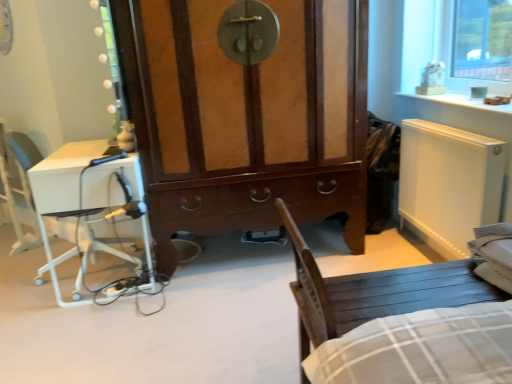
Question: Does wooden chair at lower right have a greater height compared to brown wood cabinet at center?

Choices:
 (A) no
 (B) yes

Answer: (A)

Question: Does wooden chair at lower right have a lesser height compared to brown wood cabinet at center?

Choices:
 (A) yes
 (B) no

Answer: (A)

Question: Considering the relative positions of wooden chair at lower right and brown wood cabinet at center in the image provided, is wooden chair at lower right behind brown wood cabinet at center?

Choices:
 (A) no
 (B) yes

Answer: (A)

Question: From the image's perspective, does wooden chair at lower right appear lower than brown wood cabinet at center?

Choices:
 (A) no
 (B) yes

Answer: (B)

Question: From the image's perspective, is wooden chair at lower right on brown wood cabinet at center?

Choices:
 (A) yes
 (B) no

Answer: (B)

Question: Is wooden chair at lower right touching brown wood cabinet at center?

Choices:
 (A) yes
 (B) no

Answer: (B)

Question: Is brown wood cabinet at center closer to the viewer compared to white glossy desk at left?

Choices:
 (A) no
 (B) yes

Answer: (B)

Question: Does brown wood cabinet at center have a greater height compared to white glossy desk at left?

Choices:
 (A) no
 (B) yes

Answer: (B)

Question: Can you confirm if brown wood cabinet at center is positioned to the right of white glossy desk at left?

Choices:
 (A) yes
 (B) no

Answer: (A)

Question: Does brown wood cabinet at center have a greater width compared to white glossy desk at left?

Choices:
 (A) no
 (B) yes

Answer: (B)

Question: From a real-world perspective, is brown wood cabinet at center positioned under white glossy desk at left based on gravity?

Choices:
 (A) yes
 (B) no

Answer: (B)

Question: Would you consider brown wood cabinet at center to be distant from white glossy desk at left?

Choices:
 (A) no
 (B) yes

Answer: (A)

Question: Would you say wooden chair at lower right is outside white plastic armchair at left?

Choices:
 (A) yes
 (B) no

Answer: (A)